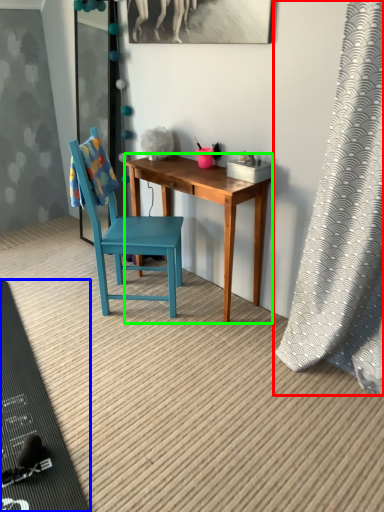
Question: Considering the real-world distances, which object is farthest from curtain (highlighted by a red box)? mat (highlighted by a blue box) or desk (highlighted by a green box)?

Choices:
 (A) mat
 (B) desk

Answer: (A)